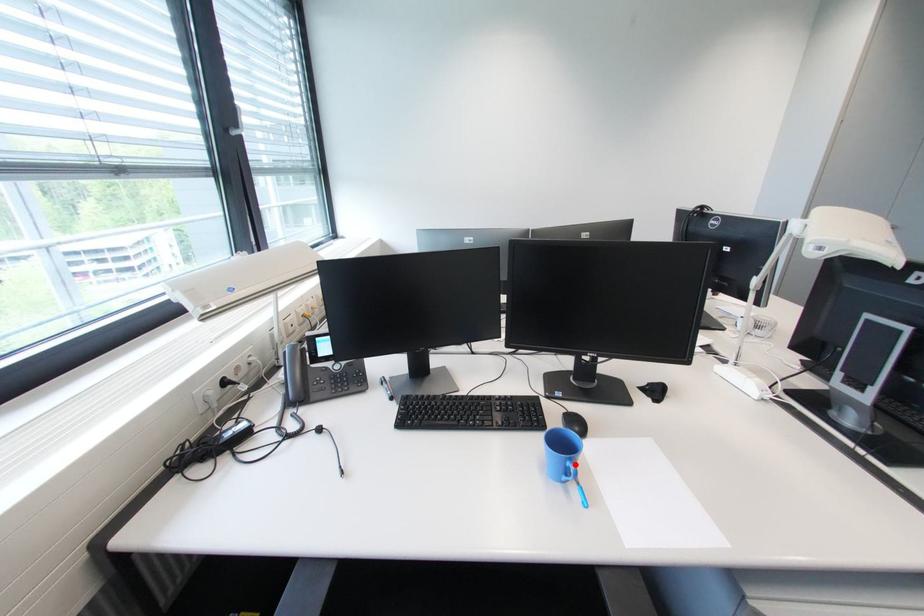
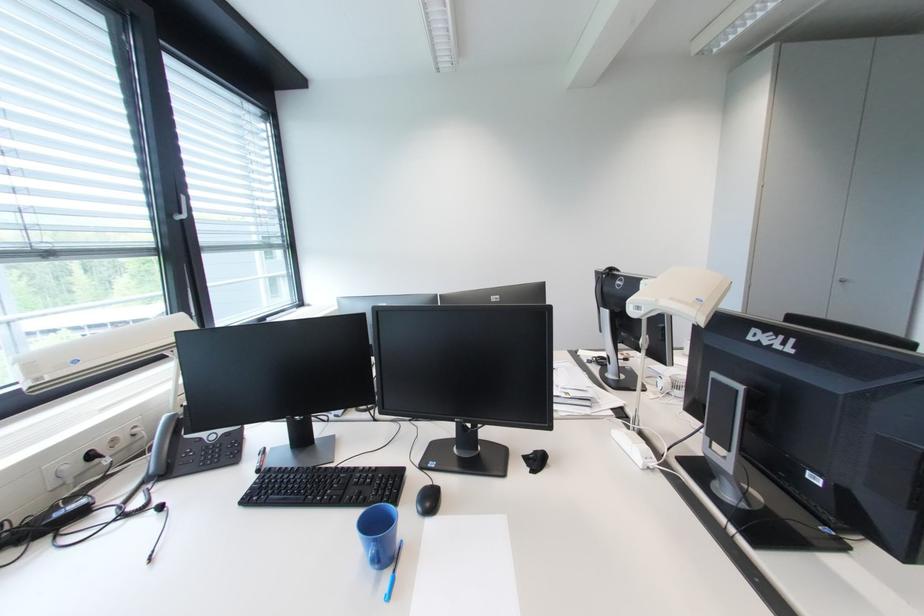
Question: I am providing you with two images of the same scene from different viewpoints. A red point is marked on the first image. At the location where the point appears in image 1, is it still visible in image 2?

Choices:
 (A) Yes
 (B) No

Answer: (A)